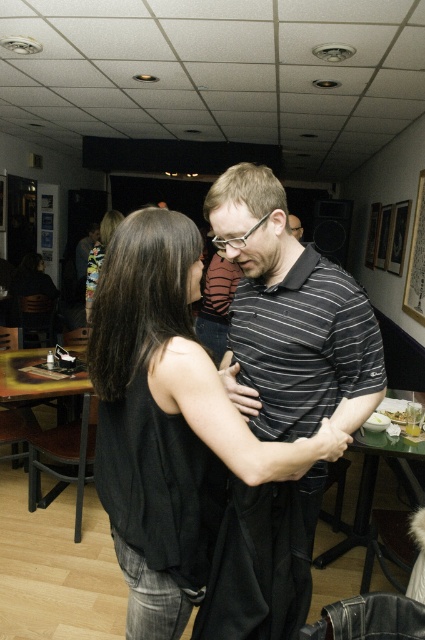
You are a photographer trying to capture the striped cotton polo shirt at center and the striped cotton shirt at center in a clear shot. Which one should you focus on first to ensure both are in focus?

You should focus on the striped cotton polo shirt at center first since it is in front of the striped cotton shirt at center, ensuring both will be in focus when starting from the front.

You are a fashion designer observing the two individuals at the center of the image. You need to determine which clothing item is shorter in length between the black cotton tank top at center and the striped cotton polo shirt at center. Which one is shorter?

The black cotton tank top at center has a lesser height compared to the striped cotton polo shirt at center, so the black cotton tank top at center is shorter in length.

From the picture: You are taking a photo of two people in a restaurant. You notice two points in the image at coordinates point (240, 285) and point (291, 230). Which point is closer to the camera?

Point (240, 285) is closer to the camera than point (291, 230).